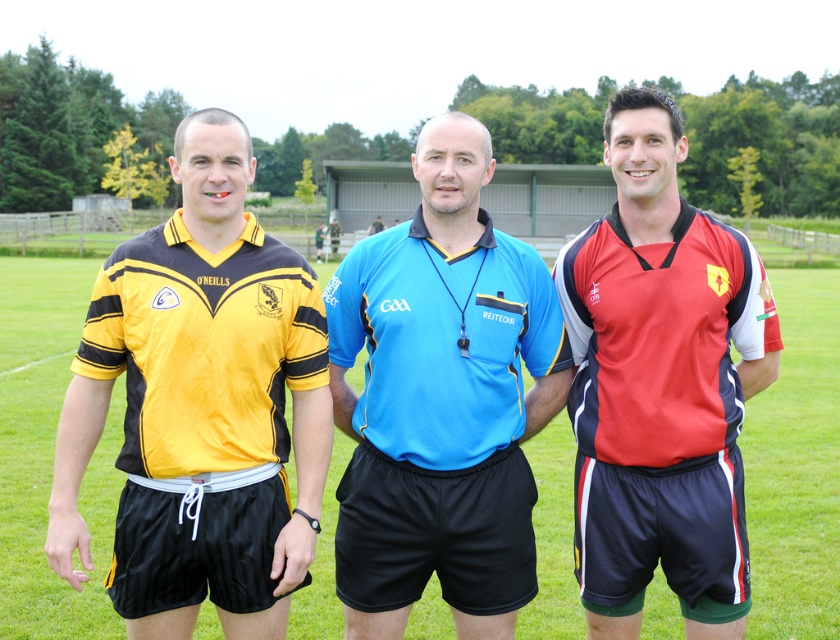
Consider the image. You are a photographer positioned behind the three people. You want to capture a photo where both the blue jersey at center and the red matte jersey at right are clearly visible. Considering their positions, which jersey is closer to the camera?

The blue jersey at center is closer to the camera than the red matte jersey at right because the blue jersey at center is positioned at center, which is in front of the red matte jersey at right.

You are a photographer standing behind the three individuals. You want to take a photo that includes both the yellow matte jersey at left and the green grass football field at center. Which object should you focus on first to ensure both are in clear view?

You should focus on the yellow matte jersey at left first because it is closer to the viewer than the green grass football field at center, so focusing on the closer object will help ensure both are in clear view.